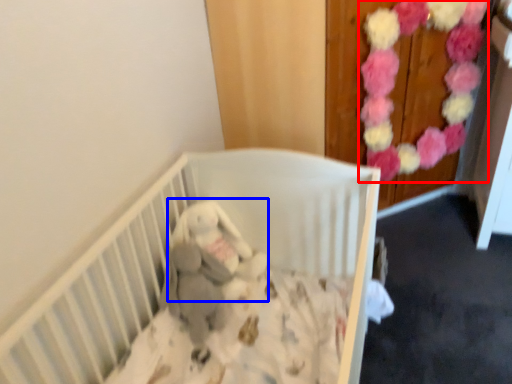
Question: Which object appears closest to the camera in this image, flower (highlighted by a red box) or baby elephant (highlighted by a blue box)?

Choices:
 (A) flower
 (B) baby elephant

Answer: (B)